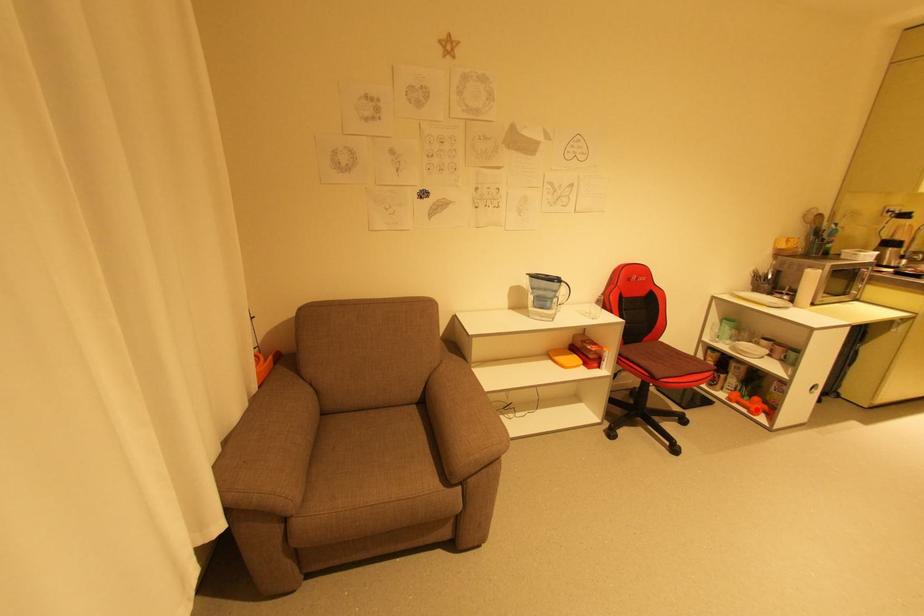
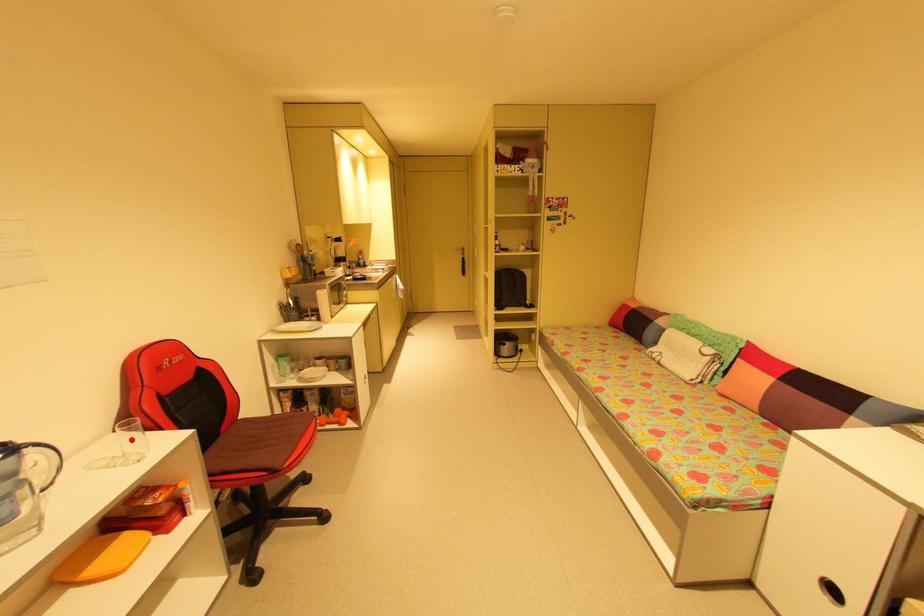
I am providing you with two images of the same scene from different viewpoints. A red point is marked on the first image and another point is marked on the second image. Does the point marked in image1 correspond to the same location as the one in image2?

No